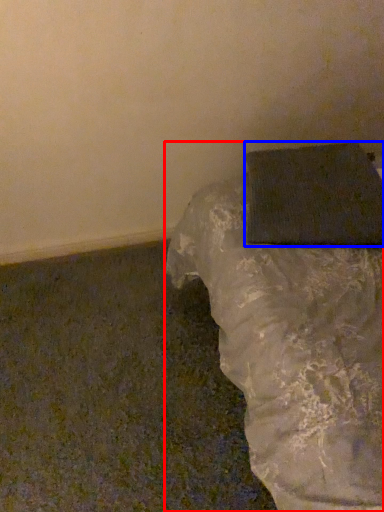
Question: Which point is further to the camera, furniture (highlighted by a red box) or wrapping paper (highlighted by a blue box)?

Choices:
 (A) furniture
 (B) wrapping paper

Answer: (B)